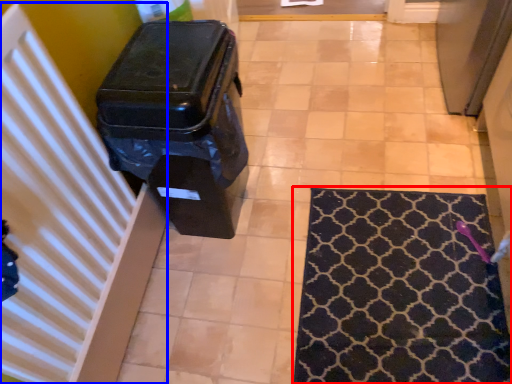
Question: Which object is further to the camera taking this photo, mat (highlighted by a red box) or radiator (highlighted by a blue box)?

Choices:
 (A) mat
 (B) radiator

Answer: (A)